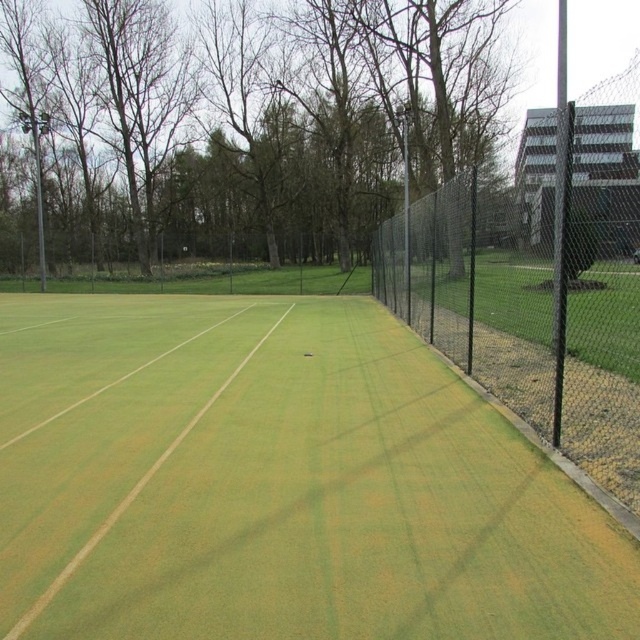
Does green turf at center have a lesser height compared to black chain-link fence at right?

Yes.

Is green turf at center behind black chain-link fence at right?

No, green turf at center is in front of black chain-link fence at right.

The image size is (640, 640). I want to click on green turf at center, so click(x=276, y=483).